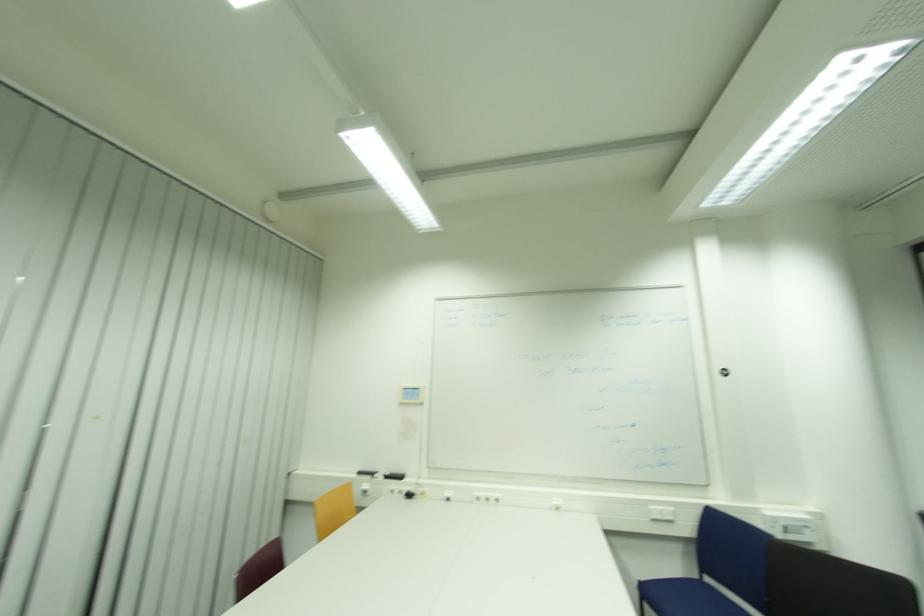
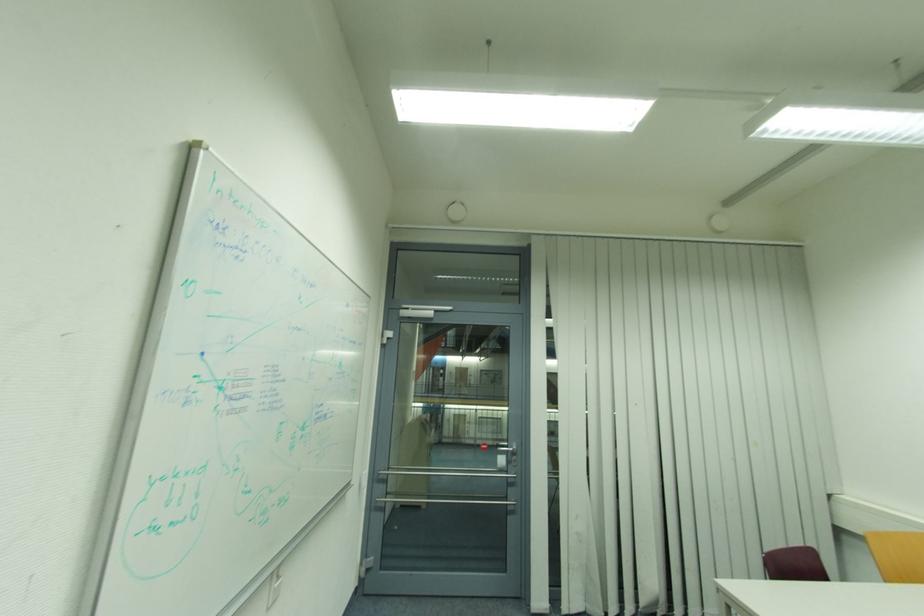
Question: The images are taken continuously from a first-person perspective. In which direction is your viewpoint rotating?

Choices:
 (A) Left
 (B) Right
 (C) Up
 (D) Down

Answer: (A)